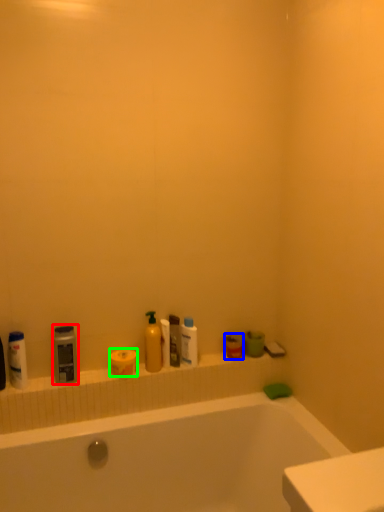
Question: Estimate the real-world distances between objects in this image. Which object is farther from cleaning product (highlighted by a red box), mouthwash (highlighted by a blue box) or toilet paper (highlighted by a green box)?

Choices:
 (A) mouthwash
 (B) toilet paper

Answer: (A)